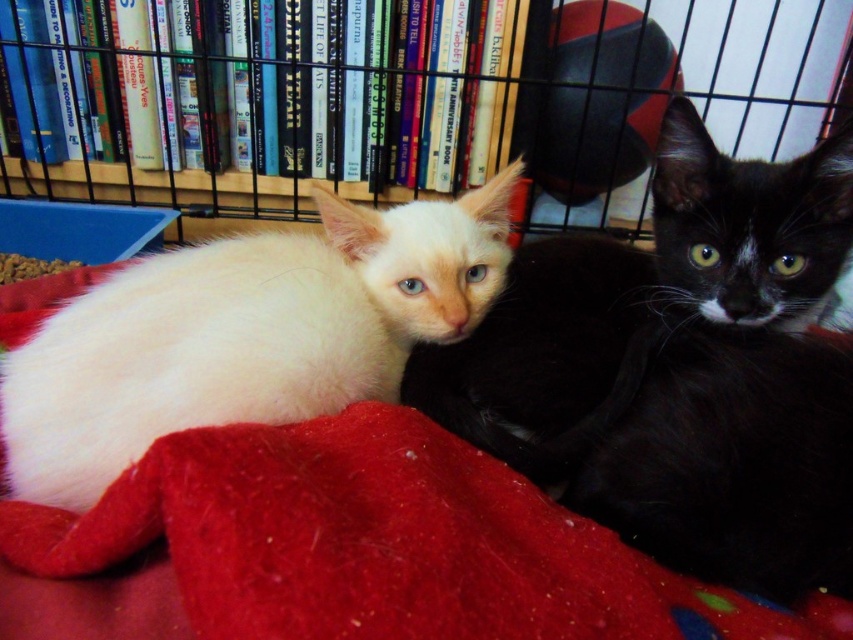
Does point (453, 394) come farther from viewer compared to point (198, 88)?

That is False.

Is white fur cat at center to the left of wooden bookshelf at upper center from the viewer's perspective?

No, white fur cat at center is not to the left of wooden bookshelf at upper center.

Locate an element on the screen. This screenshot has width=853, height=640. white fur cat at center is located at coordinates (679, 371).

Does wooden bookshelf at upper center come in front of white fluffy cat at left?

No, it is not.

Between wooden bookshelf at upper center and white fluffy cat at left, which one is positioned higher?

wooden bookshelf at upper center is higher up.

Which is behind, point (30, 106) or point (144, 337)?

The point (30, 106) is more distant.

At what (x,y) coordinates should I click in order to perform the action: click on wooden bookshelf at upper center. Please return your answer as a coordinate pair (x, y). The image size is (853, 640). Looking at the image, I should click on (264, 99).

Is white fur cat at center closer to the viewer compared to white fluffy cat at left?

That is True.

Is point (772, 573) closer to camera compared to point (131, 308)?

Yes, point (772, 573) is in front of point (131, 308).

Find the location of `white fur cat at center`. white fur cat at center is located at coordinates (679, 371).